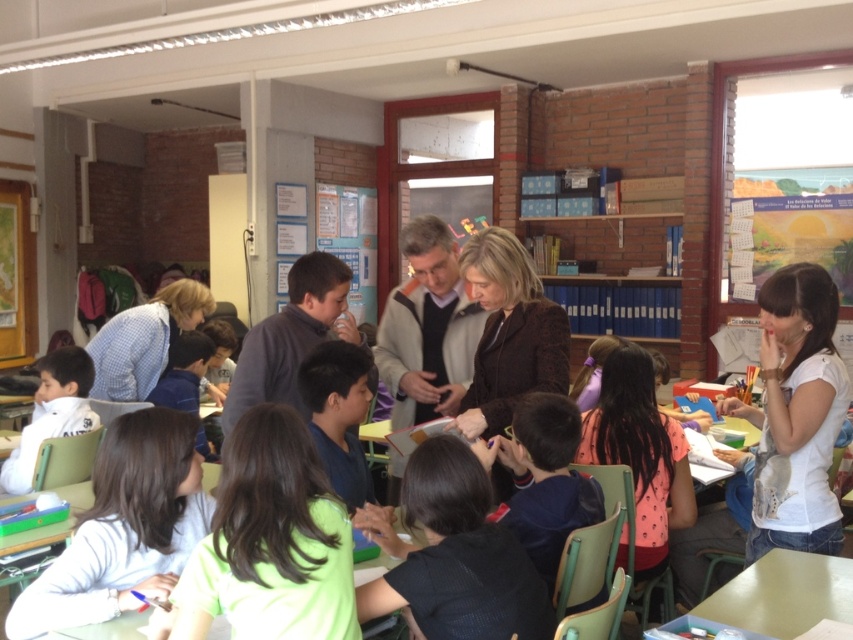
Does green fabric shirt at center have a smaller size compared to dark blue shirt at center?

No, green fabric shirt at center is not smaller than dark blue shirt at center.

Can you confirm if green fabric shirt at center is positioned below dark blue shirt at center?

Yes.

The image size is (853, 640). Identify the location of green fabric shirt at center. (270, 541).

The height and width of the screenshot is (640, 853). I want to click on green fabric shirt at center, so click(270, 541).

Does dark blue shirt at center have a greater width compared to light blue shirt at lower left?

No, dark blue shirt at center is not wider than light blue shirt at lower left.

Locate an element on the screen. dark blue shirt at center is located at coordinates (338, 413).

How much distance is there between dark blue sweater at center and dark blue shirt at center?

dark blue sweater at center is 23.59 inches away from dark blue shirt at center.

Between dark blue sweater at center and dark blue shirt at center, which one has more height?

dark blue sweater at center is taller.

Is point (517, 456) closer to camera compared to point (367, 481)?

Yes, point (517, 456) is closer to viewer.

What are the coordinates of `dark blue sweater at center` in the screenshot? It's located at (546, 481).